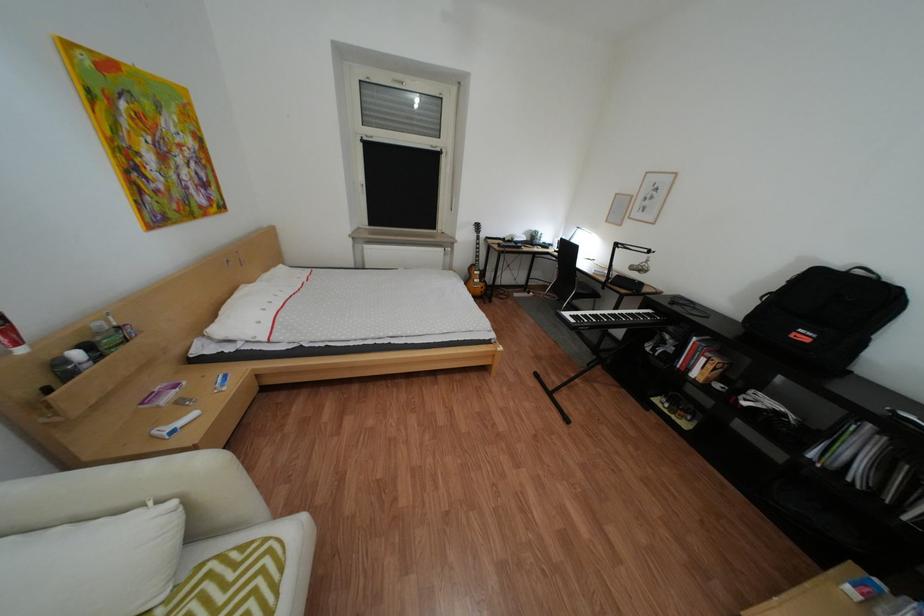
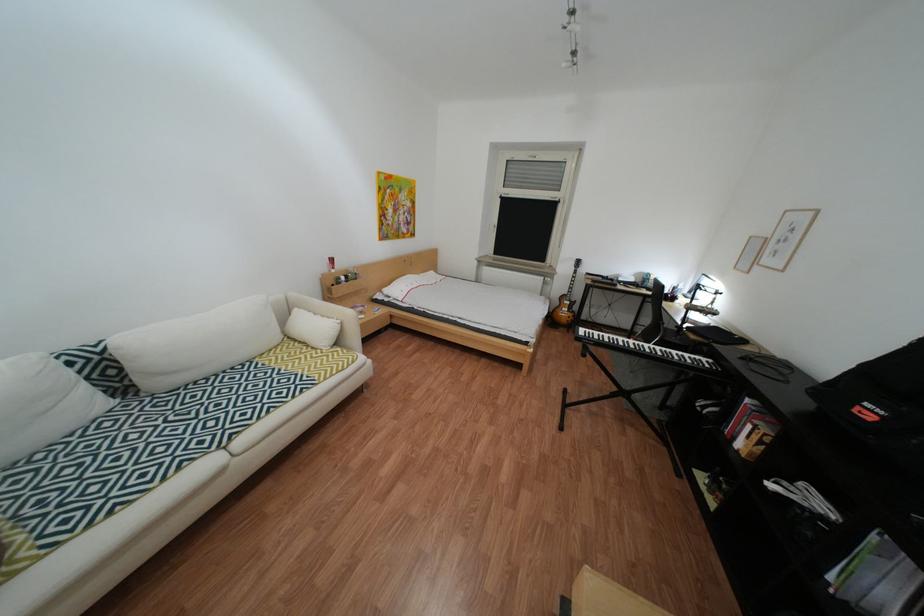
Where in the second image is the point corresponding to [704,371] from the first image?

(749, 439)